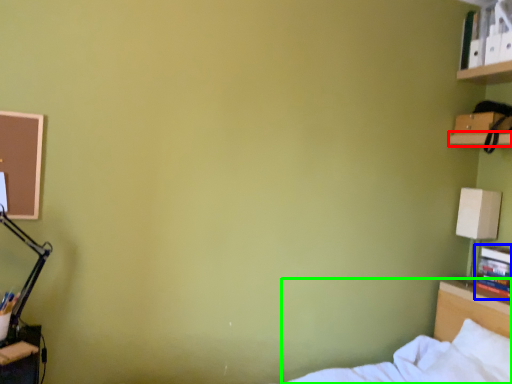
Question: Which is nearer to the shelf (highlighted by a red box)? book (highlighted by a blue box) or bed (highlighted by a green box).

Choices:
 (A) book
 (B) bed

Answer: (A)